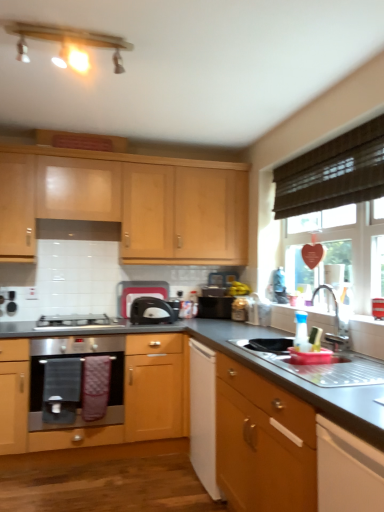
Question: Is satin black toaster at center smaller than silver metallic faucet at sink right?

Choices:
 (A) yes
 (B) no

Answer: (B)

Question: From the image's perspective, is satin black toaster at center on top of silver metallic faucet at sink right?

Choices:
 (A) no
 (B) yes

Answer: (A)

Question: Is satin black toaster at center oriented towards silver metallic faucet at sink right?

Choices:
 (A) no
 (B) yes

Answer: (B)

Question: From a real-world perspective, is satin black toaster at center under silver metallic faucet at sink right?

Choices:
 (A) yes
 (B) no

Answer: (A)

Question: Is satin black toaster at center wider than silver metallic faucet at sink right?

Choices:
 (A) yes
 (B) no

Answer: (A)

Question: From the image's perspective, is black plastic toaster at center, arranged as the first appliance when viewed from the left, positioned above or below satin black toaster at center?

Choices:
 (A) above
 (B) below

Answer: (A)

Question: In terms of height, does black plastic toaster at center, arranged as the second appliance when viewed from the right, look taller or shorter compared to satin black toaster at center?

Choices:
 (A) short
 (B) tall

Answer: (B)

Question: Is black plastic toaster at center, arranged as the second appliance when viewed from the right, situated inside satin black toaster at center or outside?

Choices:
 (A) inside
 (B) outside

Answer: (B)

Question: Is point (127, 316) positioned closer to the camera than point (142, 314)?

Choices:
 (A) farther
 (B) closer

Answer: (A)

Question: Is light wood cabinet at upper center, positioned as the 2th cabinetry in front-to-back order, taller or shorter than satin silver gas stove at lower left?

Choices:
 (A) short
 (B) tall

Answer: (B)

Question: Is light wood cabinet at upper center, positioned as the 2th cabinetry in front-to-back order, wider or thinner than satin silver gas stove at lower left?

Choices:
 (A) wide
 (B) thin

Answer: (B)

Question: Does point (241, 224) appear closer or farther from the camera than point (105, 325)?

Choices:
 (A) farther
 (B) closer

Answer: (A)

Question: Is light wood cabinet at upper center, the second cabinetry when ordered from bottom to top, situated inside satin silver gas stove at lower left or outside?

Choices:
 (A) outside
 (B) inside

Answer: (A)

Question: In terms of width, does matte wood light fixture at upper center look wider or thinner when compared to light wood cabinet at upper center, the 1th cabinetry viewed from the left?

Choices:
 (A) wide
 (B) thin

Answer: (B)

Question: Visually, is matte wood light fixture at upper center positioned to the left or to the right of light wood cabinet at upper center, the first cabinetry viewed from the top?

Choices:
 (A) left
 (B) right

Answer: (A)